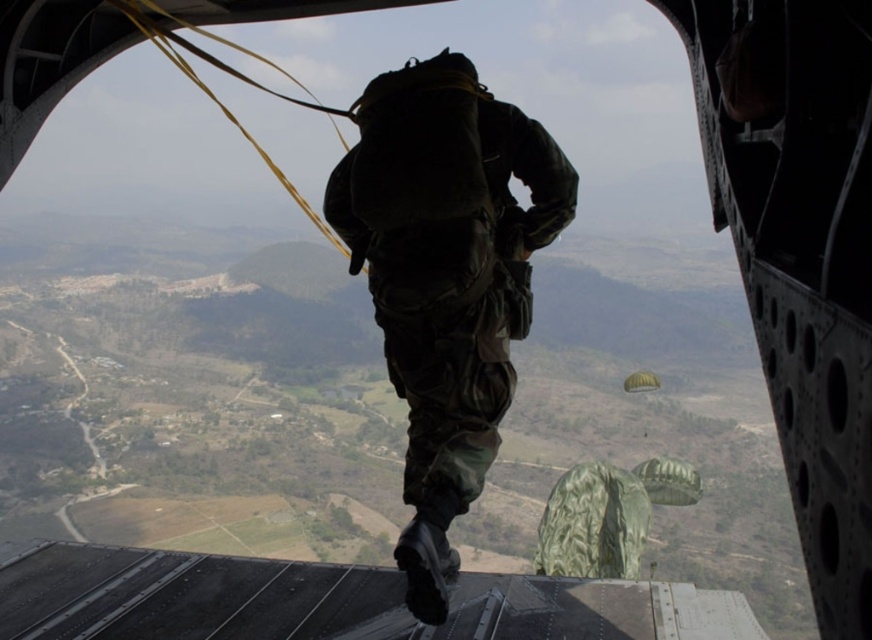
You are a pilot in the cockpit of the aircraft. You need to know if the camo fabric uniform at center is within a safe distance for you to visually confirm their position before the jump. The safe distance is 150 feet. Can you confirm?

The camo fabric uniform at center is 131.07 feet away from the camera, which is within the safe distance of 150 feet. Therefore, you can visually confirm their position.

You are a pilot observing the aircraft from the cockpit. You notice the camo fabric uniform at center and the green fabric parachute at lower center. Which object is closer to the left side of the aircraft?

The camo fabric uniform at center is closer to the left side of the aircraft because it is positioned to the left of the green fabric parachute at lower center.

You are a military observer analyzing the scene. You see the camo fabric uniform at center and the green fabric parachute at lower center. Which object is positioned closer to your viewpoint?

The camo fabric uniform at center is closer to the viewer than the green fabric parachute at lower center.